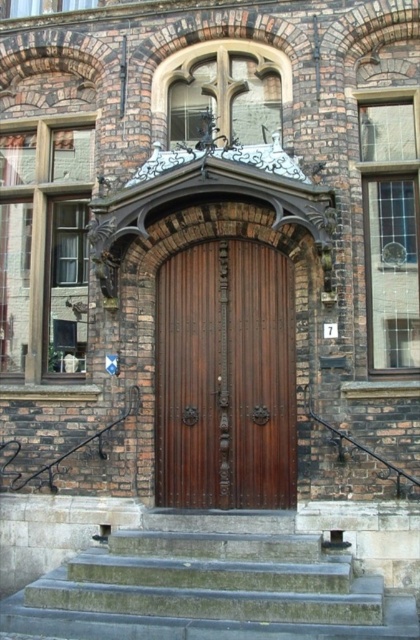
Question: Is gray stone stairs at center closer to the viewer compared to polished wood door at center?

Choices:
 (A) yes
 (B) no

Answer: (A)

Question: Does gray stone stairs at center appear over polished wood door at center?

Choices:
 (A) yes
 (B) no

Answer: (B)

Question: Where is gray stone stairs at center located in relation to polished wood door at center in the image?

Choices:
 (A) below
 (B) above

Answer: (A)

Question: Which of the following is the farthest from the observer?

Choices:
 (A) gray stone stairs at center
 (B) polished wood door at center

Answer: (B)

Question: Among these points, which one is farthest from the camera?

Choices:
 (A) (13, 605)
 (B) (220, 444)

Answer: (B)

Question: Which object is farther from the camera taking this photo?

Choices:
 (A) polished wood door at center
 (B) gray stone stairs at center

Answer: (A)